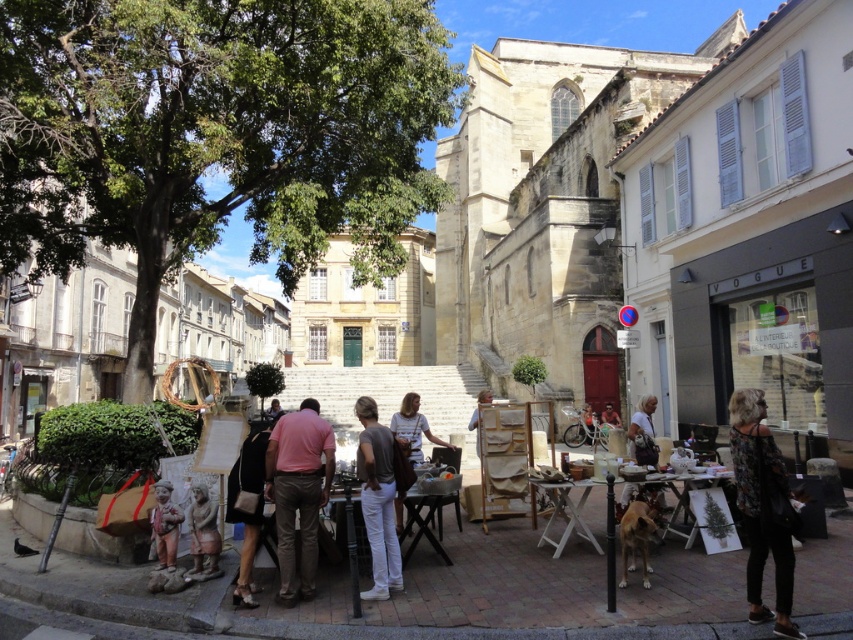
You are a street performer who needs to set up your equipment. You have a large drum that is 1.2 meters wide. You see the wooden easel at center and the matte brown statue at lower left. Can you fit your drum between them without moving either object?

The wooden easel at center might be wider than matte brown statue at lower left. Since the drum is 1.2 meters wide, it depends on the actual width of the wooden easel at center. If the wooden easel at center is indeed wider than the matte brown statue at lower left, then the space between them might accommodate the drum. However, without exact measurements, it is uncertain.